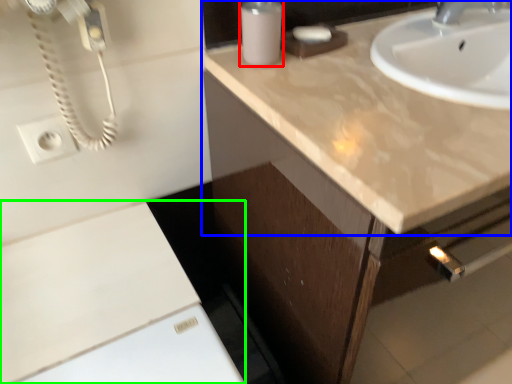
Question: Which object is positioned closest to soap dispenser (highlighted by a red box)? Select from countertop (highlighted by a blue box) and cabinetry (highlighted by a green box).

Choices:
 (A) countertop
 (B) cabinetry

Answer: (A)